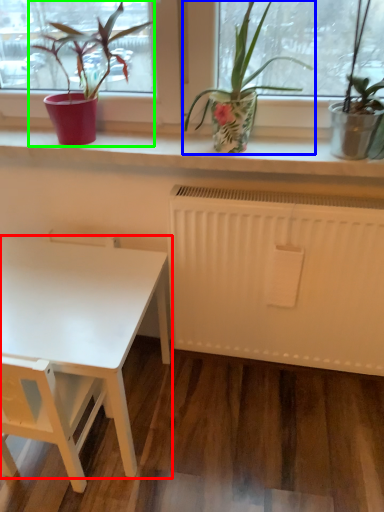
Question: Which object is positioned closest to table (highlighted by a red box)? Select from houseplant (highlighted by a blue box) and houseplant (highlighted by a green box).

Choices:
 (A) houseplant
 (B) houseplant

Answer: (B)